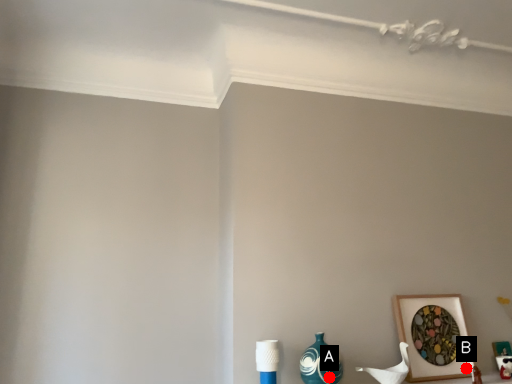
Question: Two points are circled on the image, labeled by A and B beside each circle. Which point is closer to the camera taking this photo?

Choices:
 (A) A is closer
 (B) B is closer

Answer: (A)